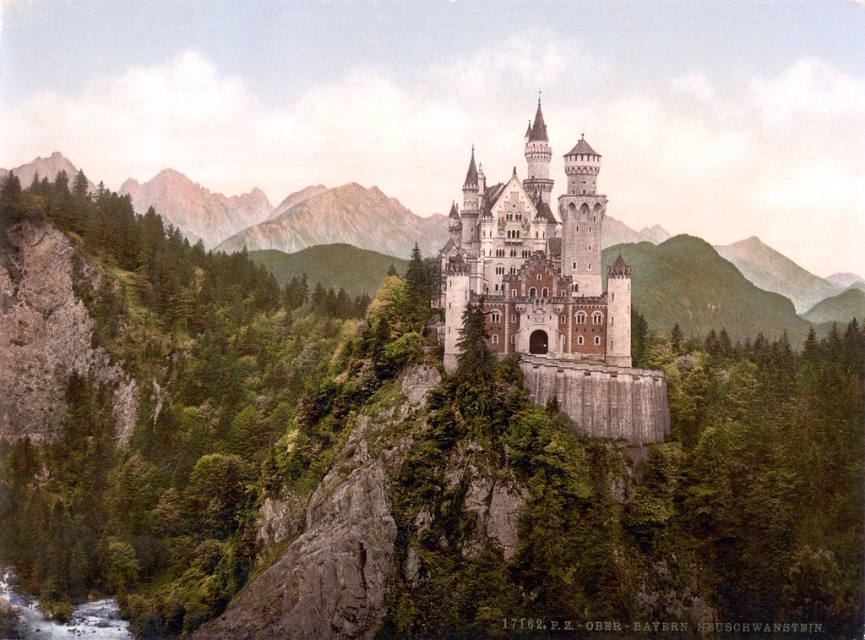
Question: Is green rocky cliff at left thinner than white stone castle at center?

Choices:
 (A) no
 (B) yes

Answer: (A)

Question: Which object appears farthest from the camera in this image?

Choices:
 (A) white stone castle at center
 (B) green rocky cliff at left

Answer: (B)

Question: Does green rocky cliff at left have a greater width compared to white stone castle at center?

Choices:
 (A) no
 (B) yes

Answer: (B)

Question: Which point is closer to the camera?

Choices:
 (A) (183, 173)
 (B) (565, 176)

Answer: (B)

Question: Observing the image, what is the correct spatial positioning of green rocky cliff at left in reference to white stone castle at center?

Choices:
 (A) below
 (B) above

Answer: (A)